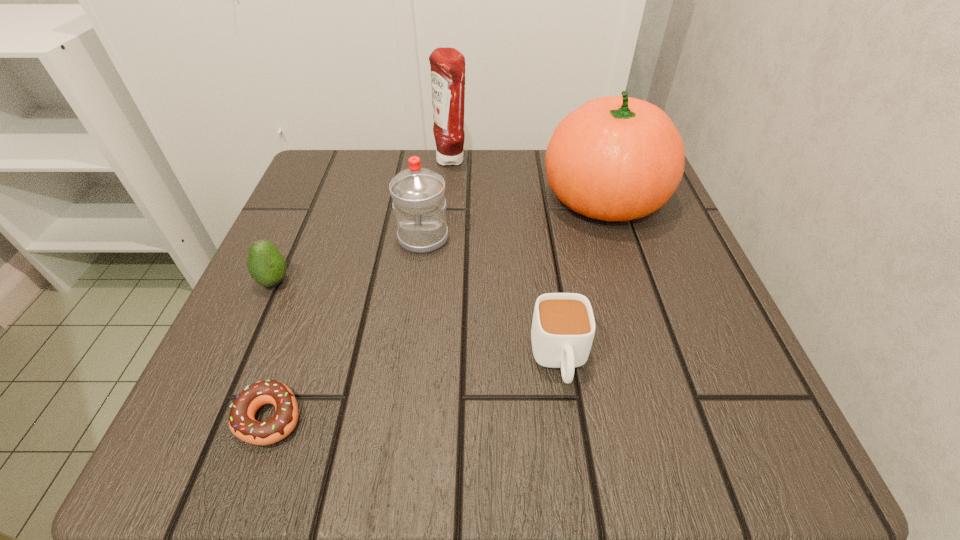
Image resolution: width=960 pixels, height=540 pixels. Identify the location of object that is at the near left corner. (242, 423).

You are a GUI agent. You are given a task and a screenshot of the screen. Output one action in this format:
    pyautogui.click(x=<x>, y=<y>)
    Task: Click on the object that is at the far right corner
    The image size is (960, 540).
    Given the screenshot: What is the action you would take?
    pyautogui.click(x=616, y=158)

At what (x,y) coordinates should I click in order to perform the action: click on vacant space at the far edge. Please return your answer as a coordinate pair (x, y). Image resolution: width=960 pixels, height=540 pixels. Looking at the image, I should click on (540, 208).

In the image, there is a desktop. Identify the location of vacant space at the near edge. (509, 465).

Image resolution: width=960 pixels, height=540 pixels. Identify the location of vacant space at the left edge of the desktop. (335, 300).

Where is `vacant position at the right edge of the desktop`? The width and height of the screenshot is (960, 540). vacant position at the right edge of the desktop is located at coordinates (699, 380).

Where is `free location at the far left corner of the desktop`? This screenshot has width=960, height=540. free location at the far left corner of the desktop is located at coordinates (365, 203).

I want to click on vacant space that is in between the cup and the avocado, so click(x=417, y=321).

The height and width of the screenshot is (540, 960). I want to click on unoccupied position between the condiment and the avocado, so click(363, 221).

The width and height of the screenshot is (960, 540). Identify the location of free space that is in between the cup and the condiment. (506, 260).